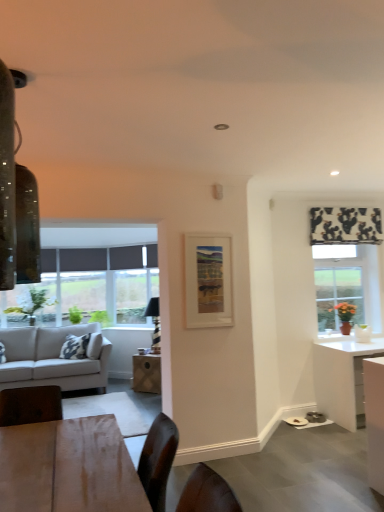
Question: Are white glossy cabinet at lower right and wooden table at center located far from each other?

Choices:
 (A) yes
 (B) no

Answer: (A)

Question: Is white glossy cabinet at lower right to the right of wooden table at center from the viewer's perspective?

Choices:
 (A) no
 (B) yes

Answer: (B)

Question: Is white glossy cabinet at lower right turned away from wooden table at center?

Choices:
 (A) no
 (B) yes

Answer: (A)

Question: Is white glossy cabinet at lower right next to wooden table at center and touching it?

Choices:
 (A) no
 (B) yes

Answer: (A)

Question: From the image's perspective, would you say white glossy cabinet at lower right is positioned over wooden table at center?

Choices:
 (A) no
 (B) yes

Answer: (B)

Question: From a real-world perspective, is white glossy cabinet at lower right beneath wooden table at center?

Choices:
 (A) no
 (B) yes

Answer: (A)

Question: Does green matte plant at right have a greater width compared to white glossy cabinet at lower right?

Choices:
 (A) yes
 (B) no

Answer: (A)

Question: From the image's perspective, is green matte plant at right located beneath white glossy cabinet at lower right?

Choices:
 (A) yes
 (B) no

Answer: (B)

Question: Is green matte plant at right bigger than white glossy cabinet at lower right?

Choices:
 (A) yes
 (B) no

Answer: (B)

Question: Is green matte plant at right completely or partially outside of white glossy cabinet at lower right?

Choices:
 (A) yes
 (B) no

Answer: (A)

Question: From the image's perspective, is green matte plant at right located above white glossy cabinet at lower right?

Choices:
 (A) no
 (B) yes

Answer: (B)

Question: Is green matte plant at right to the right of white glossy cabinet at lower right from the viewer's perspective?

Choices:
 (A) yes
 (B) no

Answer: (A)

Question: From the image's perspective, is white glossy desk at right above light gray fabric couch at left?

Choices:
 (A) no
 (B) yes

Answer: (B)